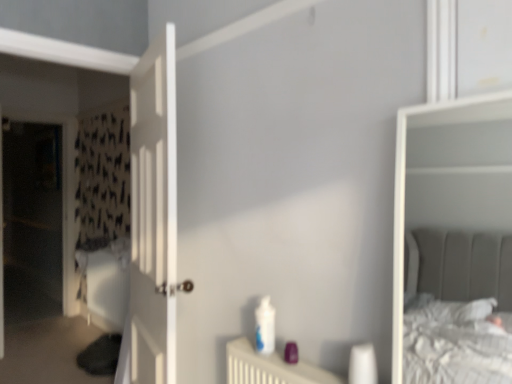
Question: Is transparent plastic screen door at left facing away from white glossy bottle at center?

Choices:
 (A) yes
 (B) no

Answer: (B)

Question: Can you confirm if transparent plastic screen door at left is thinner than white glossy bottle at center?

Choices:
 (A) no
 (B) yes

Answer: (A)

Question: From a real-world perspective, is transparent plastic screen door at left below white glossy bottle at center?

Choices:
 (A) yes
 (B) no

Answer: (B)

Question: Is there a large distance between transparent plastic screen door at left and white glossy bottle at center?

Choices:
 (A) no
 (B) yes

Answer: (B)

Question: Considering the relative sizes of transparent plastic screen door at left and white glossy bottle at center in the image provided, is transparent plastic screen door at left wider than white glossy bottle at center?

Choices:
 (A) yes
 (B) no

Answer: (A)

Question: Does transparent plastic screen door at left have a lesser height compared to white glossy bottle at center?

Choices:
 (A) no
 (B) yes

Answer: (A)

Question: From a real-world perspective, is white glossy bottle at center physically below transparent plastic screen door at left?

Choices:
 (A) no
 (B) yes

Answer: (B)

Question: Could transparent plastic screen door at left be considered to be inside white glossy bottle at center?

Choices:
 (A) yes
 (B) no

Answer: (B)

Question: Is white glossy bottle at center oriented towards transparent plastic screen door at left?

Choices:
 (A) no
 (B) yes

Answer: (A)

Question: Does white glossy bottle at center appear on the left side of transparent plastic screen door at left?

Choices:
 (A) yes
 (B) no

Answer: (B)

Question: Does white glossy bottle at center lie behind transparent plastic screen door at left?

Choices:
 (A) yes
 (B) no

Answer: (B)

Question: Is white glossy bottle at center taller than transparent plastic screen door at left?

Choices:
 (A) yes
 (B) no

Answer: (B)

Question: Does white glossy bottle at center turn towards white wooden door at left?

Choices:
 (A) no
 (B) yes

Answer: (A)